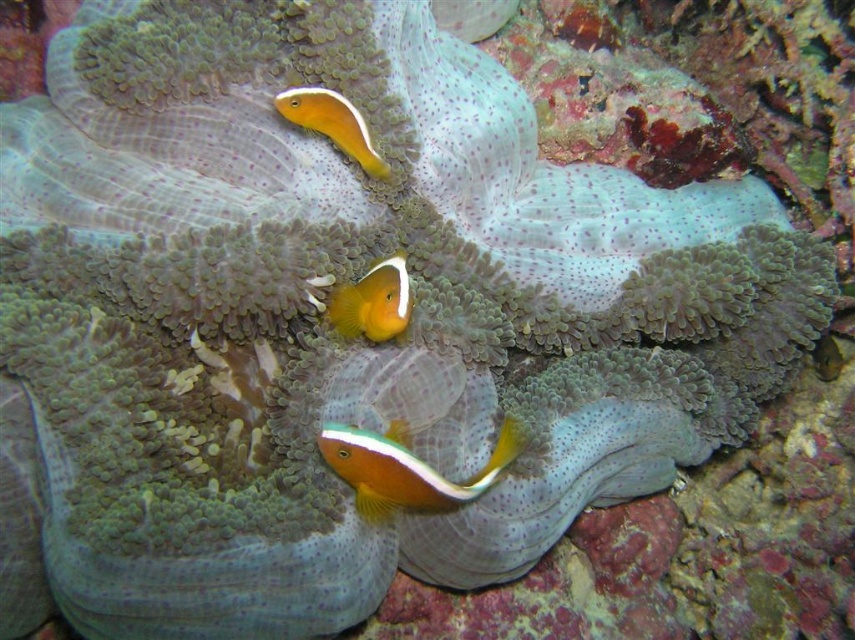
Question: Is orange matte fish at center to the left of orange matte clownfish at center from the viewer's perspective?

Choices:
 (A) yes
 (B) no

Answer: (B)

Question: Which object appears farthest from the camera in this image?

Choices:
 (A) orange matte fish at center
 (B) orange matte clownfish at center

Answer: (B)

Question: Considering the real-world distances, which object is closest to the orange matte clownfish at center?

Choices:
 (A) orange matte fish at center
 (B) orange glossy clownfish at upper center

Answer: (A)

Question: Does orange matte fish at center appear on the right side of orange glossy clownfish at upper center?

Choices:
 (A) yes
 (B) no

Answer: (A)

Question: Which of the following is the farthest from the observer?

Choices:
 (A) orange glossy clownfish at upper center
 (B) orange matte fish at center
 (C) orange matte clownfish at center

Answer: (A)

Question: Is orange matte clownfish at center further to camera compared to orange glossy clownfish at upper center?

Choices:
 (A) no
 (B) yes

Answer: (A)